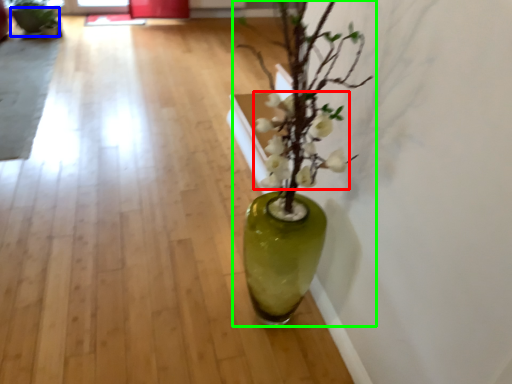
Question: Which object is positioned farthest from flower (highlighted by a red box)? Select from flowerpot (highlighted by a blue box) and houseplant (highlighted by a green box).

Choices:
 (A) flowerpot
 (B) houseplant

Answer: (A)